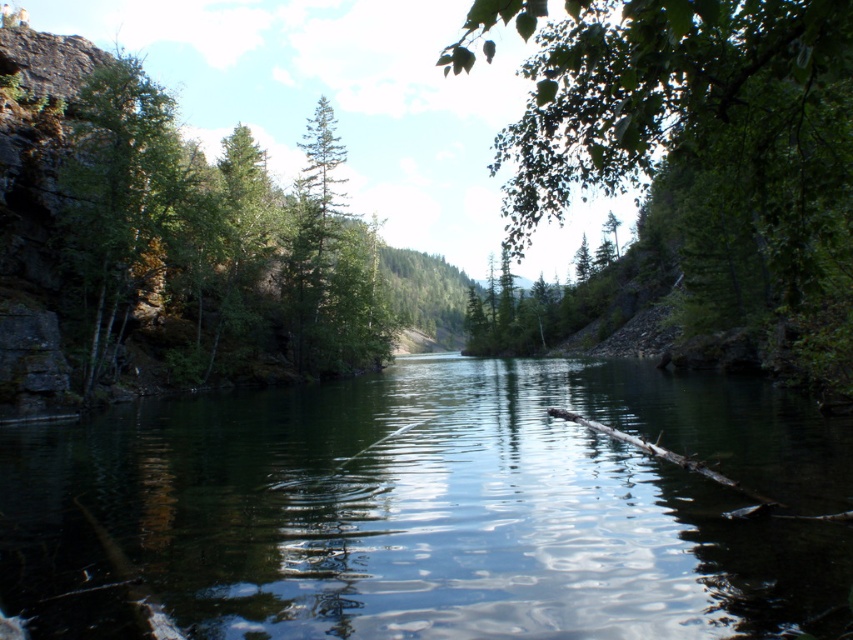
Question: From the image, what is the correct spatial relationship of green reflective water at center in relation to green leafy tree at left?

Choices:
 (A) above
 (B) below

Answer: (B)

Question: Which point is closer to the camera?

Choices:
 (A) green leafy tree at left
 (B) green reflective water at center
 (C) green matte tree at upper left

Answer: (B)

Question: Can you confirm if green reflective water at center is positioned to the left of green leafy tree at left?

Choices:
 (A) yes
 (B) no

Answer: (B)

Question: Which object is the closest to the green leafy tree at left?

Choices:
 (A) green matte tree at upper left
 (B) green reflective water at center
 (C) green leafy tree at center

Answer: (A)

Question: Among these objects, which one is farthest from the camera?

Choices:
 (A) green leafy tree at center
 (B) green matte tree at upper left
 (C) green reflective water at center

Answer: (B)

Question: Does green reflective water at center lie in front of green leafy tree at left?

Choices:
 (A) yes
 (B) no

Answer: (A)